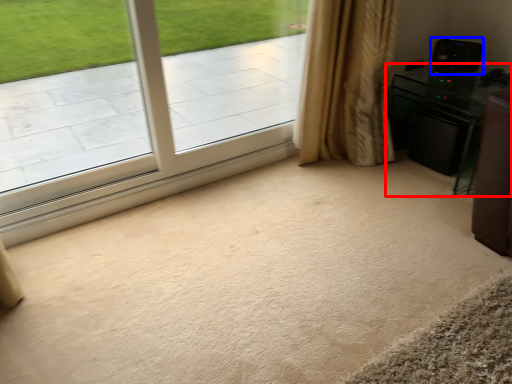
Question: Which object is closer to the camera taking this photo, furniture (highlighted by a red box) or speaker (highlighted by a blue box)?

Choices:
 (A) furniture
 (B) speaker

Answer: (A)